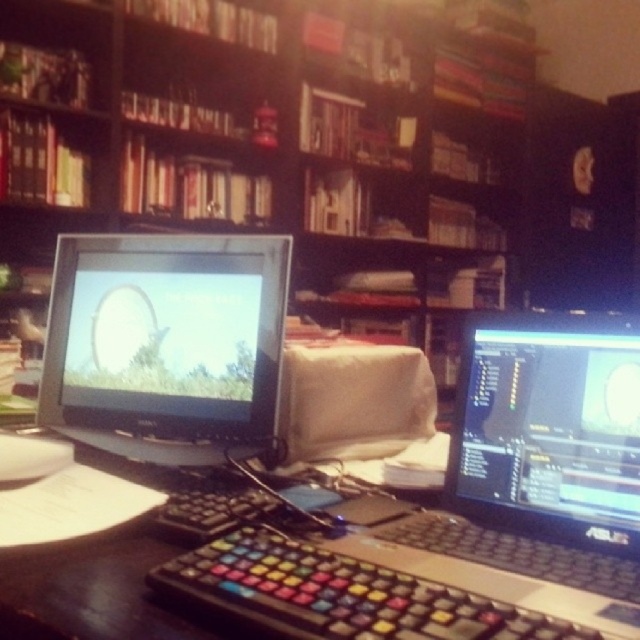
Question: From the image, what is the correct spatial relationship of wooden bookshelf at upper center in relation to black glossy monitor at center?

Choices:
 (A) right
 (B) left

Answer: (B)

Question: Considering the relative positions of black plastic laptop at center and black glossy monitor at center in the image provided, where is black plastic laptop at center located with respect to black glossy monitor at center?

Choices:
 (A) right
 (B) left

Answer: (B)

Question: From the image, what is the correct spatial relationship of wooden bookshelf at upper center in relation to black plastic laptop at center?

Choices:
 (A) left
 (B) right

Answer: (A)

Question: Estimate the real-world distances between objects in this image. Which object is farther from the black plastic laptop at center?

Choices:
 (A) black glossy monitor at center
 (B) matte black monitor at center

Answer: (B)

Question: Which is farther from the black plastic laptop at center?

Choices:
 (A) black glossy monitor at center
 (B) matte black monitor at center

Answer: (B)

Question: Among these points, which one is farthest from the camera?

Choices:
 (A) (186, 10)
 (B) (609, 397)
 (C) (56, 323)

Answer: (A)